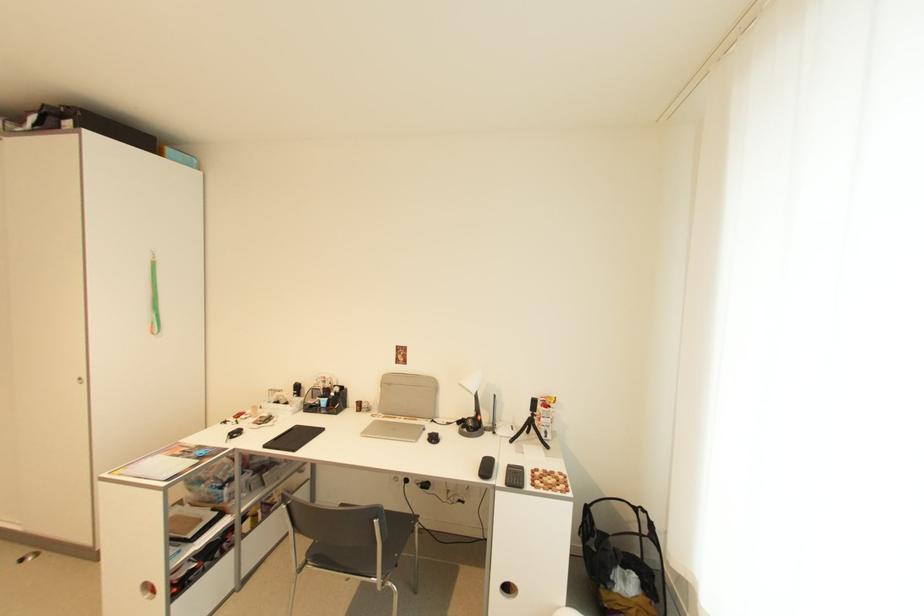
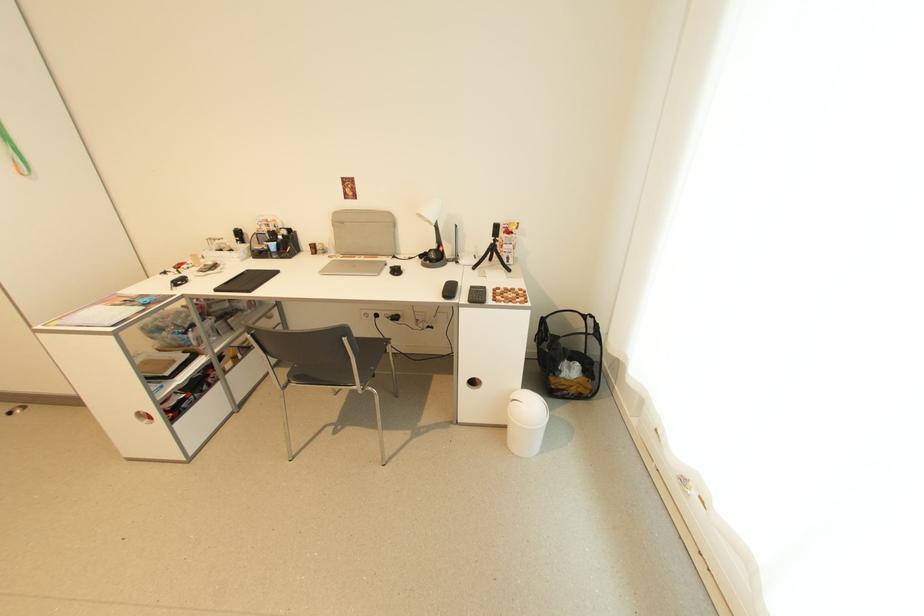
Find the pixel in the second image that matches point (477, 416) in the first image.

(439, 248)